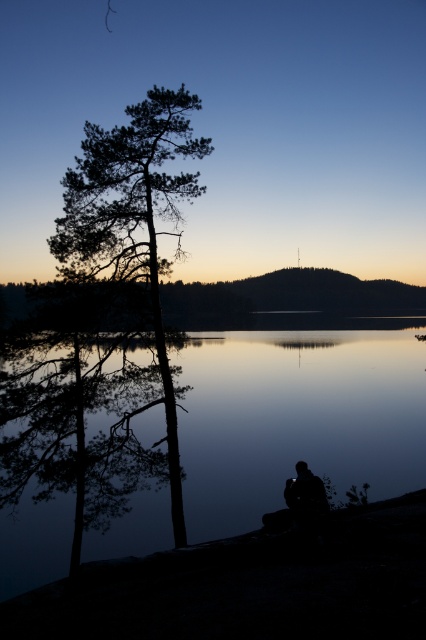
Question: Is silvery reflective water at center bigger than dark green textured tree at left?

Choices:
 (A) yes
 (B) no

Answer: (A)

Question: Which point is closer to the camera?

Choices:
 (A) dark green textured tree at left
 (B) silvery reflective water at center

Answer: (B)

Question: Is silvery reflective water at center below dark green textured tree at left?

Choices:
 (A) no
 (B) yes

Answer: (B)

Question: In this image, where is silvery reflective water at center located relative to dark green textured tree at left?

Choices:
 (A) above
 (B) below

Answer: (B)

Question: Which object appears farthest from the camera in this image?

Choices:
 (A) silvery reflective water at center
 (B) dark green textured tree at left

Answer: (B)